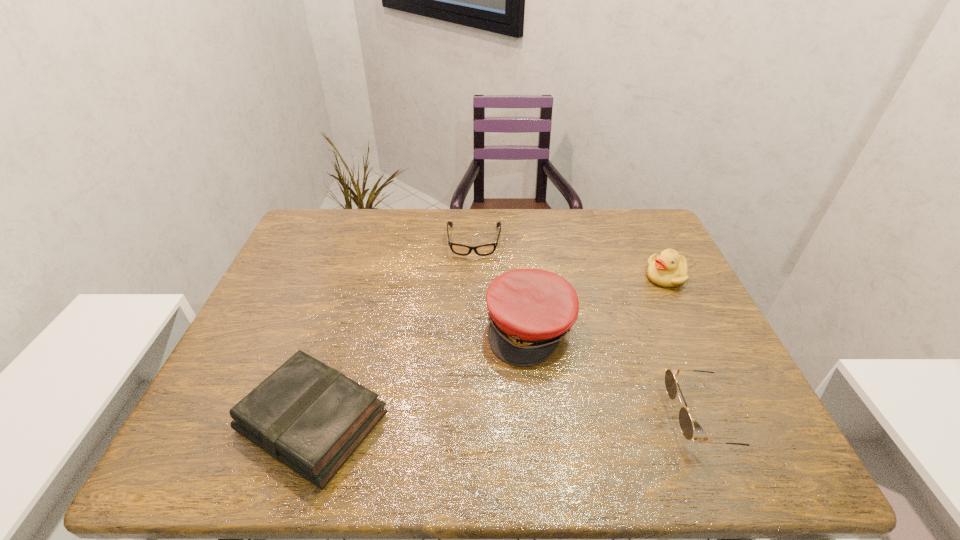
This screenshot has height=540, width=960. I want to click on vacant area situated on the front lenses of the sunglasses, so click(x=564, y=418).

I want to click on vacant position located 0.390m on the front-facing side of the shortest object, so click(468, 366).

Image resolution: width=960 pixels, height=540 pixels. Identify the location of vacant region located 0.390m on the front-facing side of the shortest object. (468, 366).

At what (x,y) coordinates should I click in order to perform the action: click on vacant space located on the front-facing side of the shortest object. Please return your answer as a coordinate pair (x, y). Looking at the image, I should click on (468, 359).

Locate an element on the screen. This screenshot has height=540, width=960. blank space located 0.100m on the front of the tallest object with an emblem is located at coordinates (530, 405).

You are a GUI agent. You are given a task and a screenshot of the screen. Output one action in this format:
    pyautogui.click(x=<x>, y=<y>)
    Task: Click on the vacant space located on the front of the tallest object with an emblem
    
    Given the screenshot: What is the action you would take?
    click(x=530, y=401)

In order to click on vacant area situated 0.130m on the front of the tallest object with an emblem in this screenshot , I will do `click(530, 417)`.

The width and height of the screenshot is (960, 540). I want to click on vacant area located on the front-facing side of the fourth nearest object, so click(x=608, y=361).

Locate an element on the screen. The width and height of the screenshot is (960, 540). vacant space located on the front-facing side of the fourth nearest object is located at coordinates (620, 343).

You are a GUI agent. You are given a task and a screenshot of the screen. Output one action in this format:
    pyautogui.click(x=<x>, y=<y>)
    Task: Click on the vacant space located 0.220m on the front-facing side of the fourth nearest object
    This screenshot has height=540, width=960.
    Given the screenshot: What is the action you would take?
    pyautogui.click(x=626, y=335)